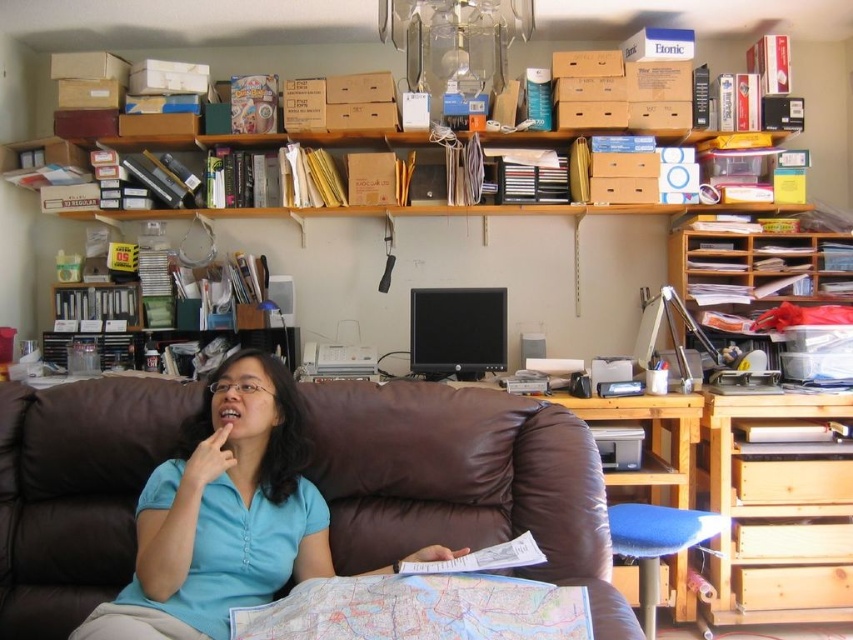
You are a delivery person who needs to place a package on the wooden desk at right. However, you notice the blue cotton shirt at center is in the way. Can you place the package on the desk without moving the shirt?

The blue cotton shirt at center is located below the wooden desk at right, so it is not blocking the desk. You can place the package on the wooden desk at right without moving the shirt.

You are standing in the home office and want to determine which of the two points, point (141, 556) or point (770, 246), is closer to you. Based on the scene, which point is nearer?

Point (141, 556) is closer to the viewer than point (770, 246).

You are organizing the office and need to move the wooden desk at right closer to the blue cotton shirt at center. Which direction should you move the desk to place it next to the shirt?

To place the wooden desk at right next to the blue cotton shirt at center, you should move the desk to the left since the blue cotton shirt at center is to the left of the wooden desk at right.